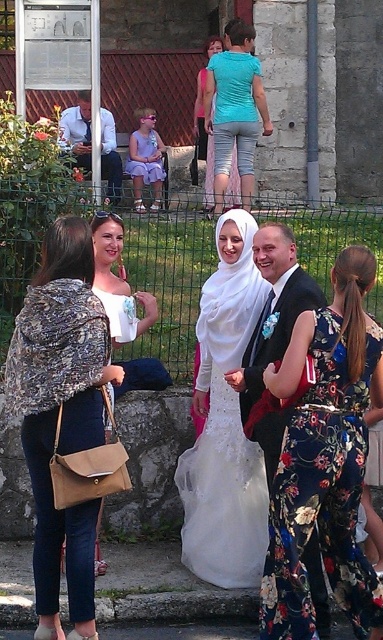
You are standing at point (140, 301) and want to walk to point (234, 468). Which direction should you move in?

You should move forward because point (234, 468) is in front of point (140, 301).

You are a photographer at a wedding. You need to position yourself so that the white lace dress at center and the white shirt at center are both in frame. Based on their positions, which one should be closer to the left side of the photo?

The white lace dress at center is to the right of the white shirt at center, so the white shirt at center should be closer to the left side of the photo.